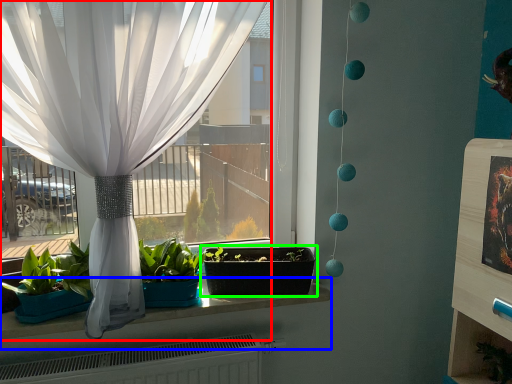
Question: Which object is the closest to the curtain (highlighted by a red box)? Choose among these: window sill (highlighted by a blue box) or flowerpot (highlighted by a green box).

Choices:
 (A) window sill
 (B) flowerpot

Answer: (B)